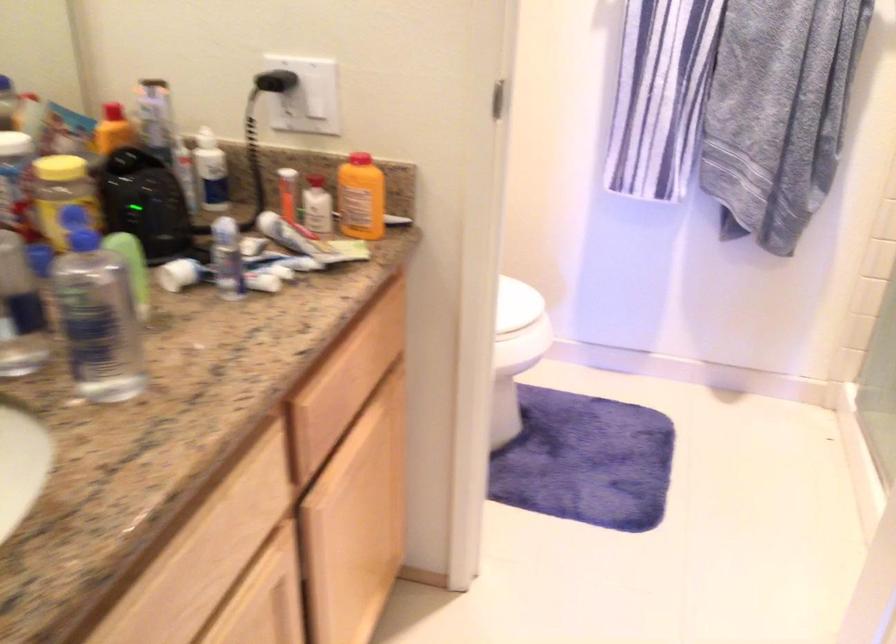
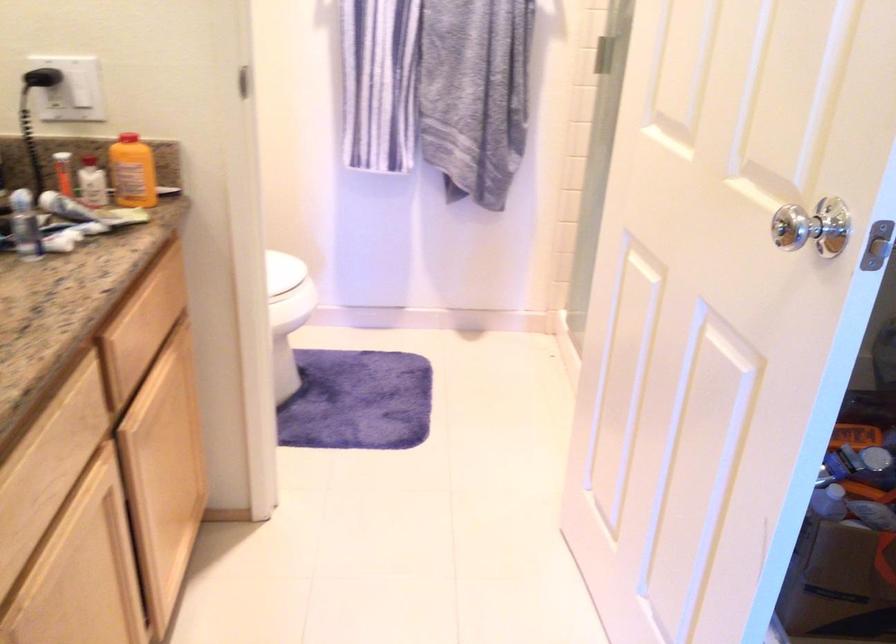
Where in the second image is the point corresponding to the point at 307,205 from the first image?

(92, 182)